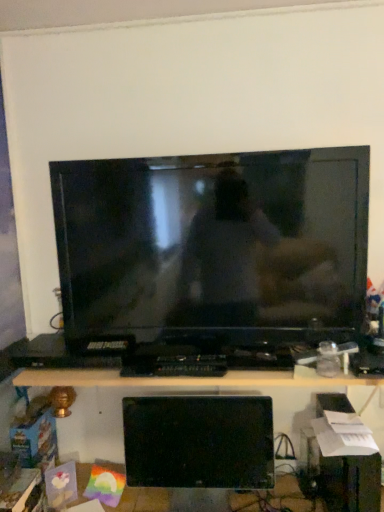
Question: Is point [x=175, y=240] positioned closer to the camera than point [x=145, y=422]?

Choices:
 (A) farther
 (B) closer

Answer: (B)

Question: From the image's perspective, is matte black television at center above or below black glossy monitor at lower center?

Choices:
 (A) below
 (B) above

Answer: (B)

Question: Considering the real-world distances, which object is farthest from the black glossy monitor at lower center?

Choices:
 (A) matte black television at center
 (B) black plastic desk at lower center

Answer: (A)

Question: Estimate the real-world distances between objects in this image. Which object is closer to the black plastic desk at lower center?

Choices:
 (A) matte black television at center
 (B) black glossy monitor at lower center

Answer: (B)